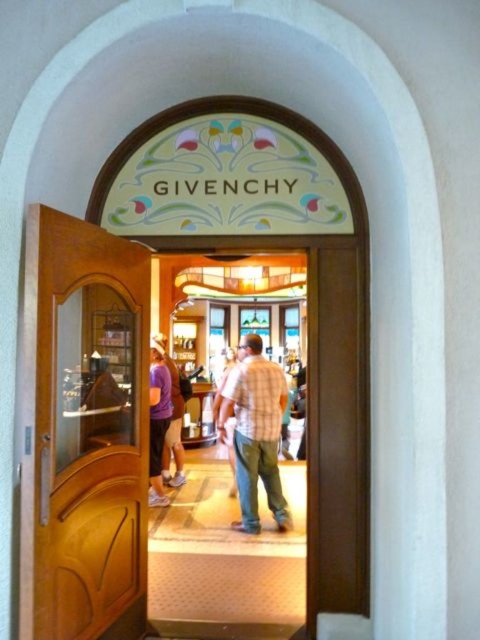
Does point (256, 392) come behind point (158, 500)?

That is False.

Does plaid shirt at center have a lesser height compared to purple fabric pants at center?

In fact, plaid shirt at center may be taller than purple fabric pants at center.

Who is more forward, (274, 428) or (168, 412)?

Point (274, 428)

Locate an element on the screen. plaid shirt at center is located at coordinates (255, 432).

Who is more distant from viewer, (86, 461) or (253, 445)?

Positioned behind is point (253, 445).

This screenshot has width=480, height=640. What do you see at coordinates (83, 438) in the screenshot? I see `wooden door at left` at bounding box center [83, 438].

Does point (87, 433) come farther from viewer compared to point (272, 394)?

No, (87, 433) is closer to viewer.

The height and width of the screenshot is (640, 480). Identify the location of wooden door at left. (83, 438).

Who is taller, wooden door at left or purple fabric pants at center?

Standing taller between the two is wooden door at left.

Is wooden door at left above purple fabric pants at center?

Yes.

What do you see at coordinates (83, 438) in the screenshot?
I see `wooden door at left` at bounding box center [83, 438].

At what (x,y) coordinates should I click in order to perform the action: click on wooden door at left. Please return your answer as a coordinate pair (x, y). The width and height of the screenshot is (480, 640). Looking at the image, I should click on (83, 438).